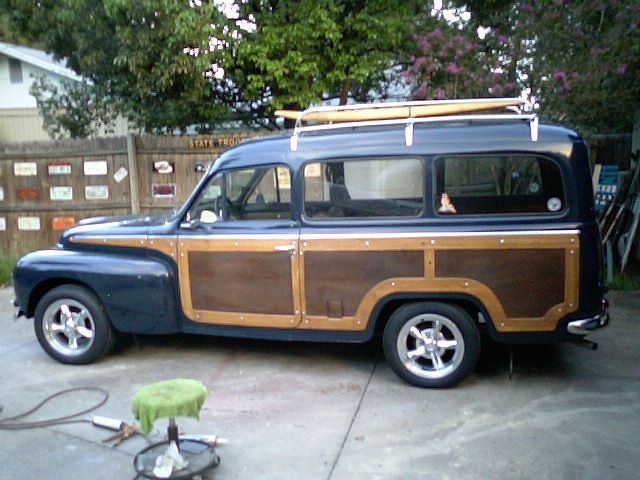
Find the location of a particular element. Image resolution: width=640 pixels, height=480 pixels. brown cable is located at coordinates [x=33, y=423].